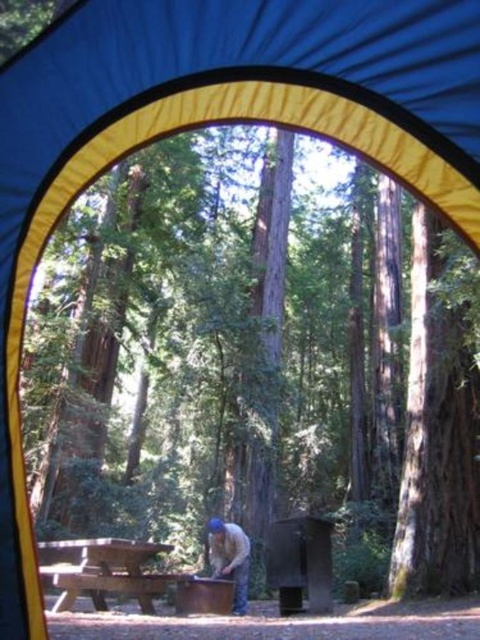
Is wooden picnic table at center shorter than brown leather jacket at lower center?

No.

The image size is (480, 640). What do you see at coordinates (101, 570) in the screenshot?
I see `wooden picnic table at center` at bounding box center [101, 570].

Find the location of a particular element. This screenshot has height=640, width=480. wooden picnic table at center is located at coordinates (101, 570).